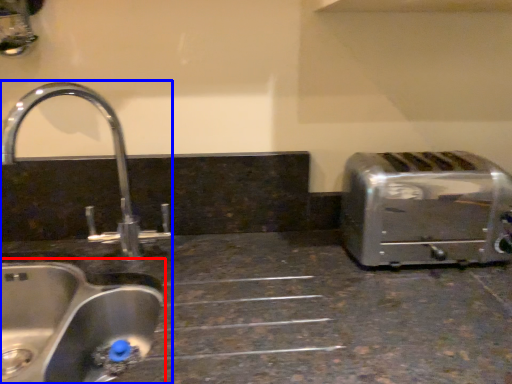
Question: Which of the following is the closest to the observer, sink (highlighted by a red box) or sink (highlighted by a blue box)?

Choices:
 (A) sink
 (B) sink

Answer: (A)